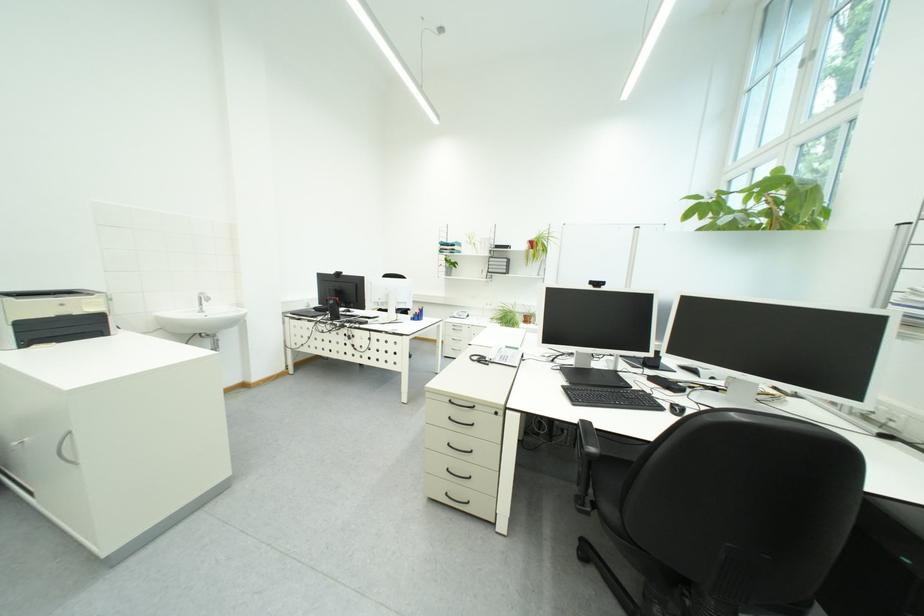
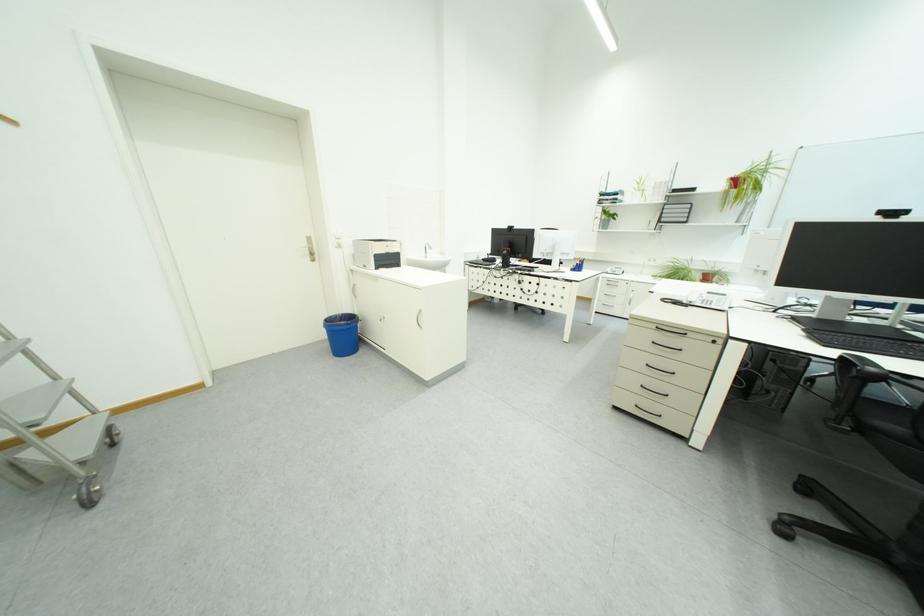
Find the pixel in the second image that matches (x=602, y=285) in the first image.

(893, 215)